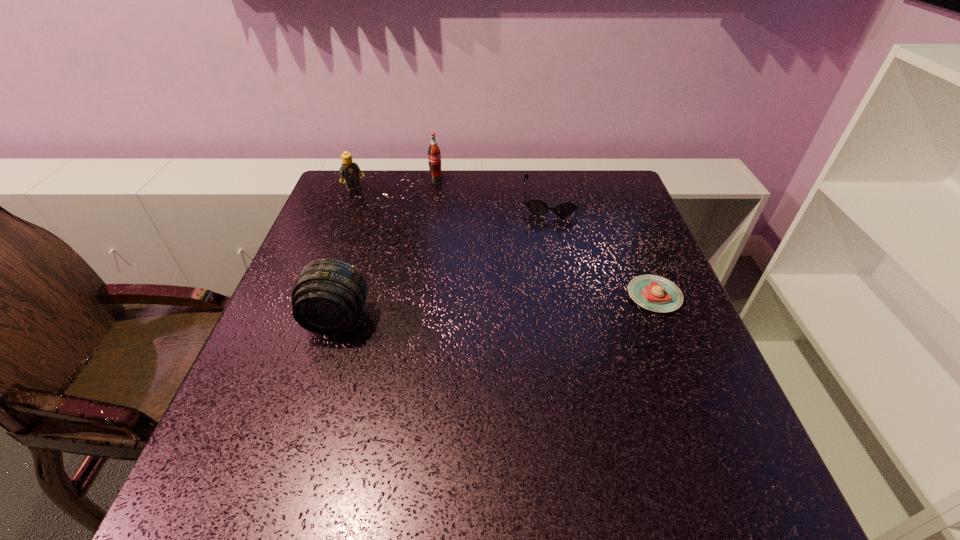
This screenshot has width=960, height=540. I want to click on free spot between the telephoto lens and the shortest object, so click(495, 308).

I want to click on vacant space that's between the shortest object and the third tallest object, so click(x=505, y=242).

I want to click on unoccupied area between the second shortest object and the farthest object, so click(x=494, y=191).

The image size is (960, 540). In order to click on unoccupied area between the second shortest object and the telephoto lens in this screenshot , I will do `click(444, 260)`.

The height and width of the screenshot is (540, 960). In order to click on free point between the third object from left to right and the third shortest object in this screenshot , I will do `click(396, 185)`.

Choose which object is the fourth nearest neighbor to the farthest object. Please provide its 2D coordinates. Your answer should be formatted as a tuple, i.e. [(x, y)], where the tuple contains the x and y coordinates of a point satisfying the conditions above.

[(655, 293)]

At what (x,y) coordinates should I click in order to perform the action: click on object that is the third nearest to the telephoto lens. Please return your answer as a coordinate pair (x, y). This screenshot has width=960, height=540. Looking at the image, I should click on (434, 155).

You are a GUI agent. You are given a task and a screenshot of the screen. Output one action in this format:
    pyautogui.click(x=<x>, y=<y>)
    Task: Click on the vacant space that satisfies the following two spatial constraints: 1. on the front side of the third shortest object; 2. on the left side of the second shortest object
    This screenshot has width=960, height=540.
    Given the screenshot: What is the action you would take?
    pyautogui.click(x=350, y=201)

Where is `vacant space that satisfies the following two spatial constraints: 1. on the back side of the third shortest object; 2. on the right side of the soda bottle`? This screenshot has height=540, width=960. vacant space that satisfies the following two spatial constraints: 1. on the back side of the third shortest object; 2. on the right side of the soda bottle is located at coordinates (358, 181).